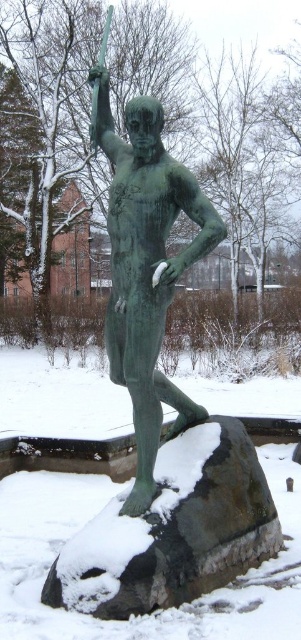
Between snow-covered rock at center and green patina bronze statue at center, which one has less height?

Standing shorter between the two is snow-covered rock at center.

Can you confirm if snow-covered rock at center is shorter than green patina bronze statue at center?

Indeed, snow-covered rock at center has a lesser height compared to green patina bronze statue at center.

Identify the location of snow-covered rock at center. (173, 531).